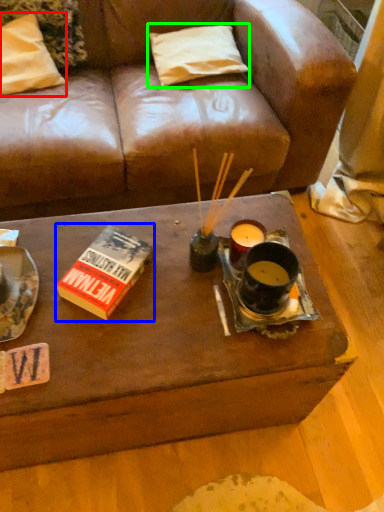
Question: Which is nearer to the pillow (highlighted by a red box)? paperback book (highlighted by a blue box) or pillow (highlighted by a green box).

Choices:
 (A) paperback book
 (B) pillow

Answer: (B)